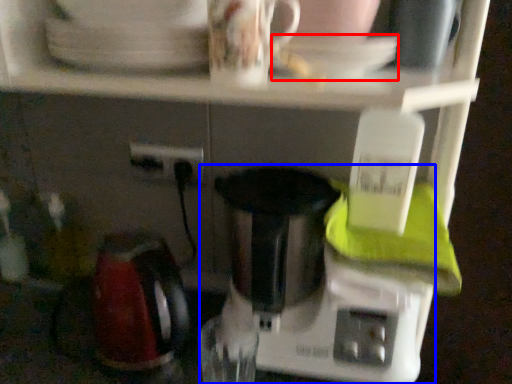
Question: Which point is further to the camera, saucer (highlighted by a red box) or mixer (highlighted by a blue box)?

Choices:
 (A) saucer
 (B) mixer

Answer: (B)